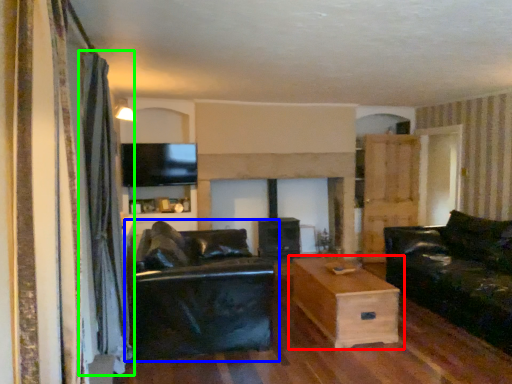
Question: Estimate the real-world distances between objects in this image. Which object is farther from table (highlighted by a red box), studio couch (highlighted by a blue box) or curtain (highlighted by a green box)?

Choices:
 (A) studio couch
 (B) curtain

Answer: (B)